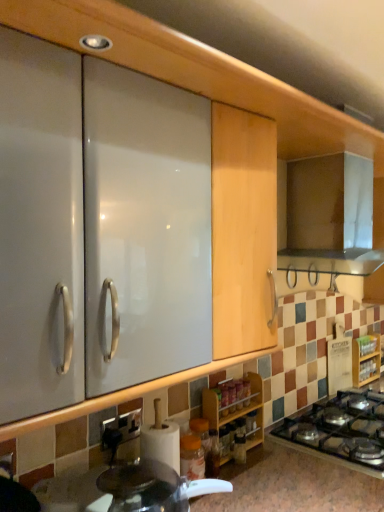
Question: From the image's perspective, is white glossy countertop at lower center located above black glass gas stove at lower right?

Choices:
 (A) yes
 (B) no

Answer: (A)

Question: Considering the relative positions of white glossy countertop at lower center and black glass gas stove at lower right in the image provided, is white glossy countertop at lower center to the right of black glass gas stove at lower right from the viewer's perspective?

Choices:
 (A) yes
 (B) no

Answer: (B)

Question: Considering the relative sizes of white glossy countertop at lower center and black glass gas stove at lower right in the image provided, is white glossy countertop at lower center shorter than black glass gas stove at lower right?

Choices:
 (A) yes
 (B) no

Answer: (B)

Question: Considering the relative positions of white glossy countertop at lower center and black glass gas stove at lower right in the image provided, is white glossy countertop at lower center to the left of black glass gas stove at lower right from the viewer's perspective?

Choices:
 (A) yes
 (B) no

Answer: (A)

Question: From the image's perspective, does white glossy countertop at lower center appear lower than black glass gas stove at lower right?

Choices:
 (A) yes
 (B) no

Answer: (B)

Question: Is white glossy countertop at lower center further to the viewer compared to black glass gas stove at lower right?

Choices:
 (A) no
 (B) yes

Answer: (A)

Question: Would you say wooden spice rack at lower center, marked as the 2th cabinetry in a back-to-front arrangement, contains wooden spice rack at lower right, which appears as the 1th cabinetry when viewed from the right?

Choices:
 (A) yes
 (B) no

Answer: (B)

Question: Considering the relative sizes of wooden spice rack at lower center, which is the second cabinetry from right to left, and wooden spice rack at lower right, which appears as the 2th cabinetry when viewed from the left, in the image provided, is wooden spice rack at lower center, which is the second cabinetry from right to left, thinner than wooden spice rack at lower right, which appears as the 2th cabinetry when viewed from the left,?

Choices:
 (A) yes
 (B) no

Answer: (B)

Question: From a real-world perspective, is wooden spice rack at lower center, marked as the 2th cabinetry in a back-to-front arrangement, over wooden spice rack at lower right, which appears as the 2th cabinetry when viewed from the left?

Choices:
 (A) no
 (B) yes

Answer: (A)

Question: From a real-world perspective, is wooden spice rack at lower center, marked as the 2th cabinetry in a back-to-front arrangement, below wooden spice rack at lower right, which appears as the 1th cabinetry when viewed from the right?

Choices:
 (A) no
 (B) yes

Answer: (B)

Question: Is wooden spice rack at lower right, which appears as the 1th cabinetry when viewed from the right, at the back of wooden spice rack at lower center, marked as the 2th cabinetry in a back-to-front arrangement?

Choices:
 (A) no
 (B) yes

Answer: (A)

Question: Can you confirm if wooden spice rack at lower center, the first cabinetry positioned from the left, is positioned to the left of wooden spice rack at lower right, which appears as the 2th cabinetry when viewed from the left?

Choices:
 (A) no
 (B) yes

Answer: (B)

Question: Is wooden spice rack at lower right, which is the 2th cabinetry from front to back, at the left side of white glossy countertop at lower center?

Choices:
 (A) no
 (B) yes

Answer: (A)